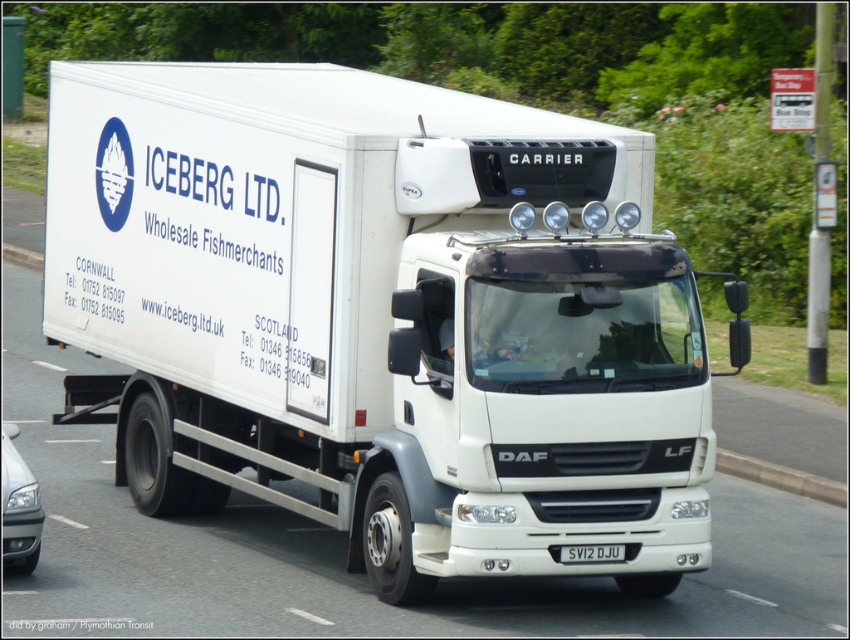
Which of these two, white matte truck at center or black plastic license plate at center, stands taller?

Standing taller between the two is white matte truck at center.

Is white matte truck at center to the right of black plastic license plate at center from the viewer's perspective?

Incorrect, white matte truck at center is not on the right side of black plastic license plate at center.

Is point (684, 292) less distant than point (571, 563)?

That is False.

Locate an element on the screen. white matte truck at center is located at coordinates (382, 316).

Is matte silver headlight at lower left wider than black plastic license plate at center?

No.

Is the position of matte silver headlight at lower left less distant than that of black plastic license plate at center?

No, matte silver headlight at lower left is further to the viewer.

This screenshot has width=850, height=640. In order to click on matte silver headlight at lower left in this screenshot , I will do `click(18, 508)`.

Does white matte truck at center appear over matte silver headlight at lower left?

Indeed, white matte truck at center is positioned over matte silver headlight at lower left.

The height and width of the screenshot is (640, 850). In order to click on white matte truck at center in this screenshot , I will do `click(382, 316)`.

The height and width of the screenshot is (640, 850). I want to click on white matte truck at center, so click(x=382, y=316).